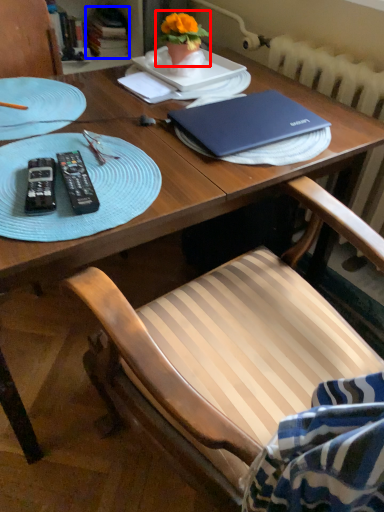
Question: Which point is closer to the camera, houseplant (highlighted by a red box) or book (highlighted by a blue box)?

Choices:
 (A) houseplant
 (B) book

Answer: (A)